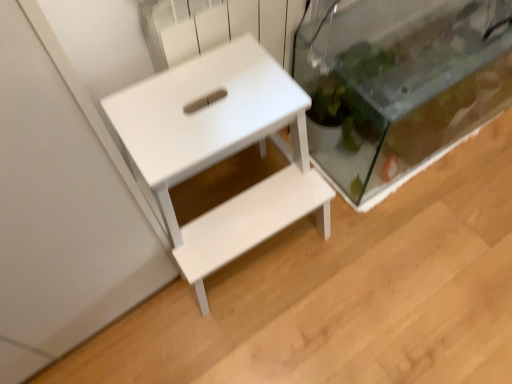
This screenshot has width=512, height=384. Find the location of `free spot below white matte table at center (from a real-world perspective)`. free spot below white matte table at center (from a real-world perspective) is located at coordinates (251, 254).